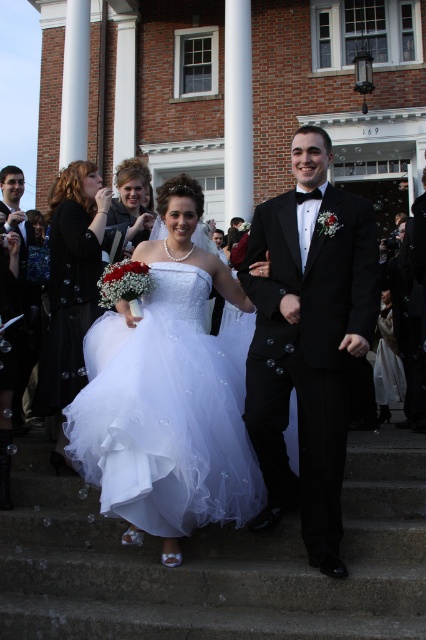
Is smooth concrete stairs at center wider than shiny black tuxedo at left?

Yes, smooth concrete stairs at center is wider than shiny black tuxedo at left.

Is point (354, 493) positioned in front of point (17, 403)?

That is True.

Does point (184, 595) lie in front of point (25, 241)?

Yes, point (184, 595) is closer to viewer.

Where is `smooth concrete stairs at center`? This screenshot has height=640, width=426. smooth concrete stairs at center is located at coordinates (215, 563).

Which is above, white tulle dress at center or shiny black tuxedo at left?

shiny black tuxedo at left is above.

Which is below, white tulle dress at center or shiny black tuxedo at left?

white tulle dress at center

Between point (199, 212) and point (28, 352), which one is positioned behind?

The point (28, 352) is more distant.

At what (x,y) coordinates should I click in order to perform the action: click on white tulle dress at center. Please return your answer as a coordinate pair (x, y). Looking at the image, I should click on (166, 396).

Does smooth concrete stairs at center have a larger size compared to matte white dress at center?

Actually, smooth concrete stairs at center might be smaller than matte white dress at center.

Which of these two, smooth concrete stairs at center or matte white dress at center, stands taller?

matte white dress at center

What do you see at coordinates (215, 563) in the screenshot? This screenshot has height=640, width=426. I see `smooth concrete stairs at center` at bounding box center [215, 563].

Where is `smooth concrete stairs at center`? Image resolution: width=426 pixels, height=640 pixels. smooth concrete stairs at center is located at coordinates (215, 563).